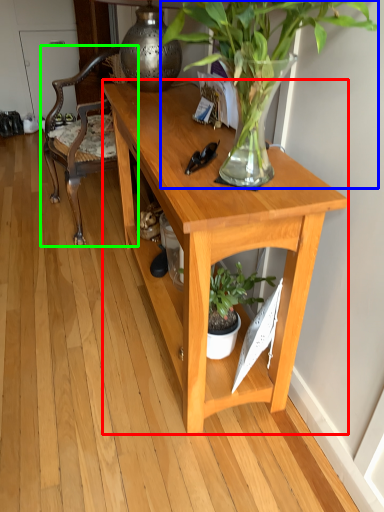
Question: Considering the real-world distances, which object is closest to desk (highlighted by a red box)? houseplant (highlighted by a blue box) or chair (highlighted by a green box).

Choices:
 (A) houseplant
 (B) chair

Answer: (A)